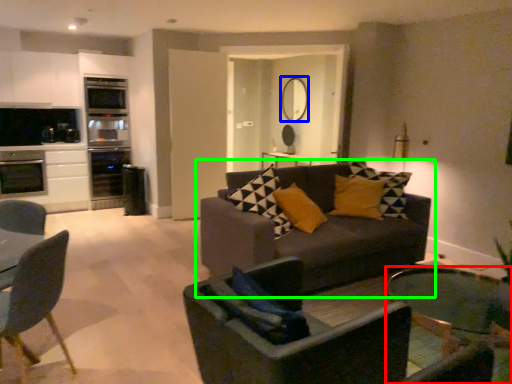
Question: Considering the real-world distances, which object is closest to coffee table (highlighted by a red box)? mirror (highlighted by a blue box) or studio couch (highlighted by a green box).

Choices:
 (A) mirror
 (B) studio couch

Answer: (B)